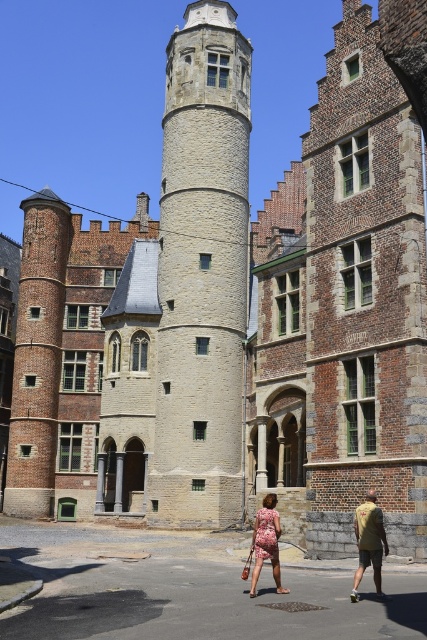
Is khaki cotton shirt at lower right wider than floral dress at center?

Correct, the width of khaki cotton shirt at lower right exceeds that of floral dress at center.

In the scene shown: Between khaki cotton shirt at lower right and floral dress at center, which one has more height?

floral dress at center

Find the location of a particular element. The height and width of the screenshot is (640, 427). khaki cotton shirt at lower right is located at coordinates (368, 541).

Is light gray stone tower at center shorter than floral dress at center?

Incorrect, light gray stone tower at center's height does not fall short of floral dress at center's.

Which is above, light gray stone tower at center or floral dress at center?

Positioned higher is light gray stone tower at center.

Identify the location of light gray stone tower at center. The height and width of the screenshot is (640, 427). (201, 273).

Between point (218, 161) and point (359, 536), which one is positioned behind?

Positioned behind is point (218, 161).

How distant is light gray stone tower at center from khaki cotton shirt at lower right?

A distance of 31.07 meters exists between light gray stone tower at center and khaki cotton shirt at lower right.

Who is more distant from viewer, (204, 184) or (377, 508)?

The point (204, 184) is more distant.

Identify the location of light gray stone tower at center. (201, 273).